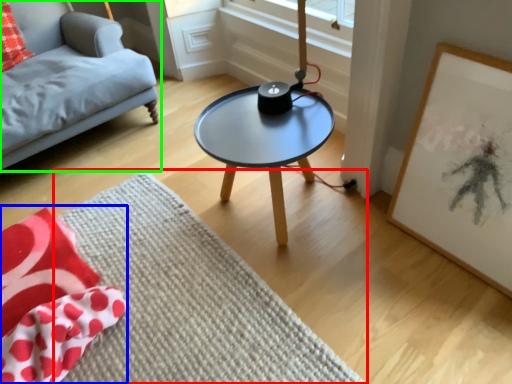
Question: Considering the real-world distances, which object is farthest from mat (highlighted by a red box)? blanket (highlighted by a blue box) or studio couch (highlighted by a green box)?

Choices:
 (A) blanket
 (B) studio couch

Answer: (B)